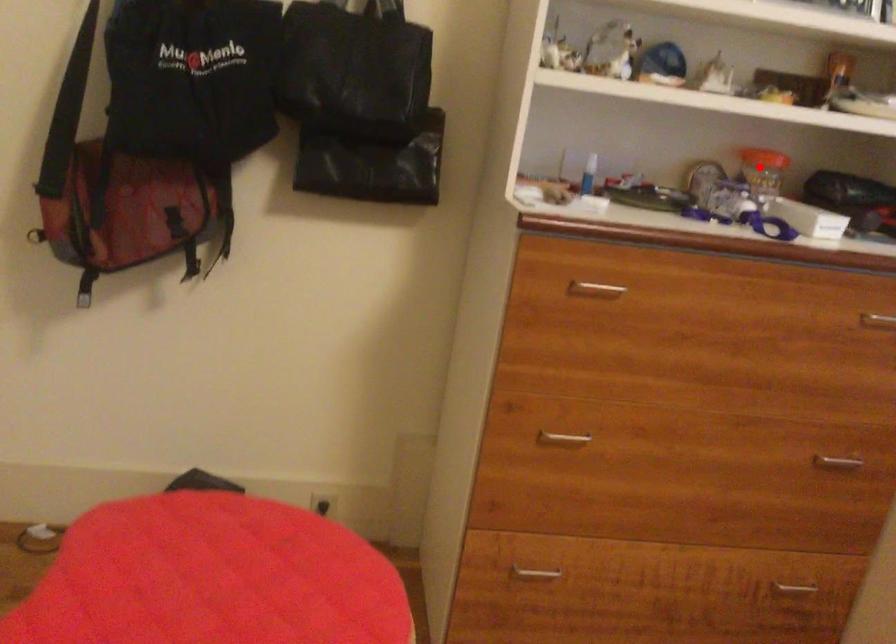
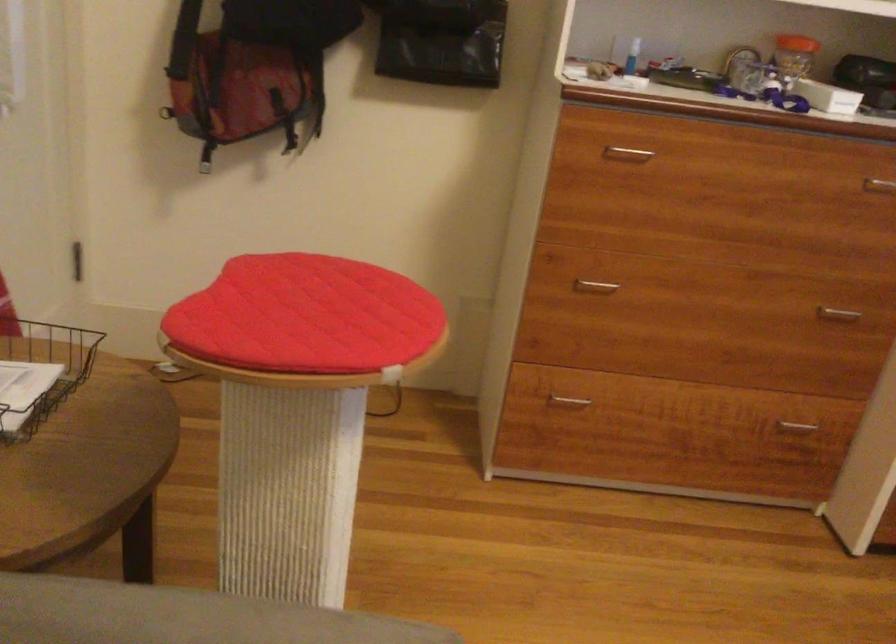
The point at the highlighted location is marked in the first image. Where is the corresponding point in the second image?

(794, 53)